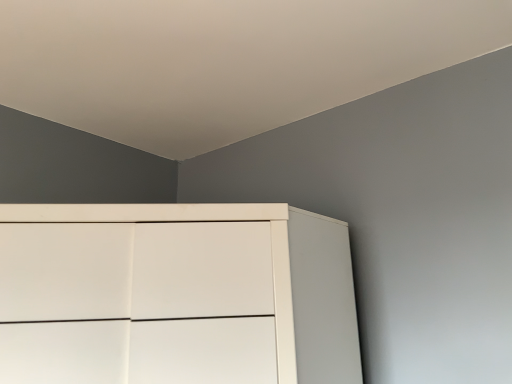
Identify the location of white matte cabinet at center. (175, 294).

Describe the element at coordinates (175, 294) in the screenshot. I see `white matte cabinet at center` at that location.

You are a GUI agent. You are given a task and a screenshot of the screen. Output one action in this format:
    pyautogui.click(x=<x>, y=<y>)
    Task: Click on the white matte cabinet at center
    The image size is (512, 384).
    Given the screenshot: What is the action you would take?
    pyautogui.click(x=175, y=294)